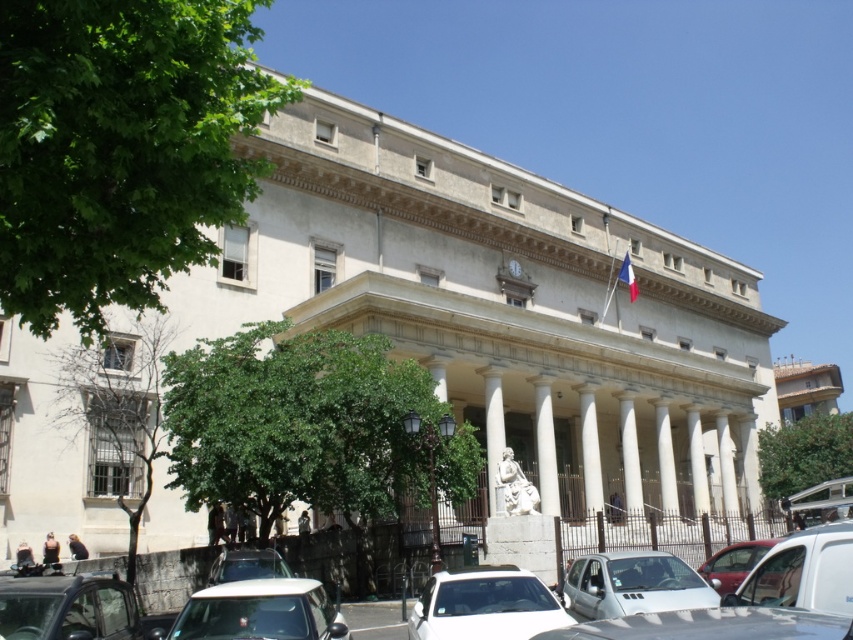
Who is positioned more to the right, white matte car at lower center or metallic silver car at lower center?

white matte car at lower center

Where is `white matte car at lower center`? white matte car at lower center is located at coordinates (260, 611).

Who is more distant from viewer, [308,595] or [231,552]?

The point [231,552] is more distant.

Find the location of a particular element. white matte car at lower center is located at coordinates (260, 611).

Can you confirm if white matte car at lower right is bigger than shiny silver car at lower right?

Actually, white matte car at lower right might be smaller than shiny silver car at lower right.

At what (x,y) coordinates should I click in order to perform the action: click on white matte car at lower right. Please return your answer as a coordinate pair (x, y). Looking at the image, I should click on (631, 584).

Between metallic silver car at lower left and metallic red car at lower right, which one appears on the left side from the viewer's perspective?

Positioned to the left is metallic silver car at lower left.

Is metallic silver car at lower left to the right of metallic red car at lower right from the viewer's perspective?

Incorrect, metallic silver car at lower left is not on the right side of metallic red car at lower right.

Measure the distance between point [102,605] and camera.

A distance of 30.41 meters exists between point [102,605] and camera.

Where is `metallic silver car at lower left`? metallic silver car at lower left is located at coordinates (68, 608).